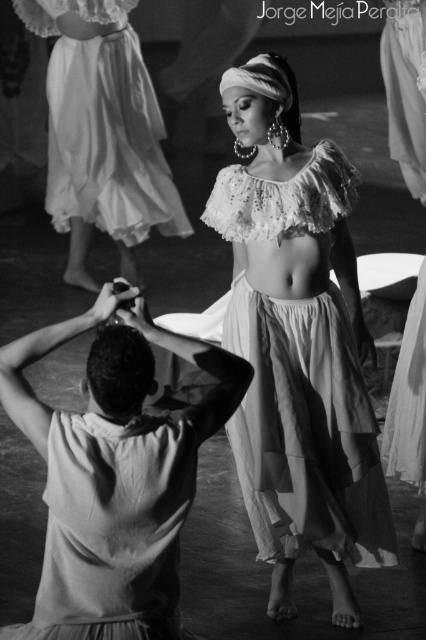
Who is taller, light beige fabric skirt at center or white sheer skirt at upper center?

With more height is white sheer skirt at upper center.

Does point (94, 509) come farther from viewer compared to point (134, 102)?

No.

At what (x,y) coordinates should I click in order to perform the action: click on light beige fabric skirt at center. Please return your answer as a coordinate pair (x, y). Looking at the image, I should click on (115, 474).

Is matte white fabric skirt at center in front of white sheer skirt at center?

Yes, matte white fabric skirt at center is in front of white sheer skirt at center.

Who is shorter, matte white fabric skirt at center or white sheer skirt at center?

Standing shorter between the two is white sheer skirt at center.

This screenshot has width=426, height=640. I want to click on matte white fabric skirt at center, so click(298, 344).

Is point (141, 132) in front of point (402, 0)?

No, (141, 132) is behind (402, 0).

Who is lower down, white sheer skirt at upper center or white sheer skirt at center?

→ white sheer skirt at center

Is point (69, 65) positioned after point (423, 465)?

Yes, it is behind point (423, 465).

This screenshot has height=640, width=426. In order to click on white sheer skirt at upper center in this screenshot , I will do `click(103, 125)`.